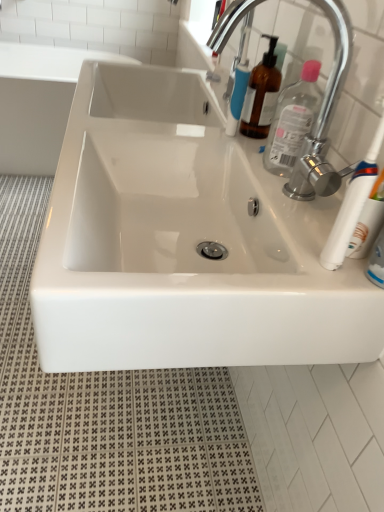
Where is `free spot below chrome metallic faucet at upper right (from a real-world perspective)`? This screenshot has height=512, width=384. free spot below chrome metallic faucet at upper right (from a real-world perspective) is located at coordinates (291, 210).